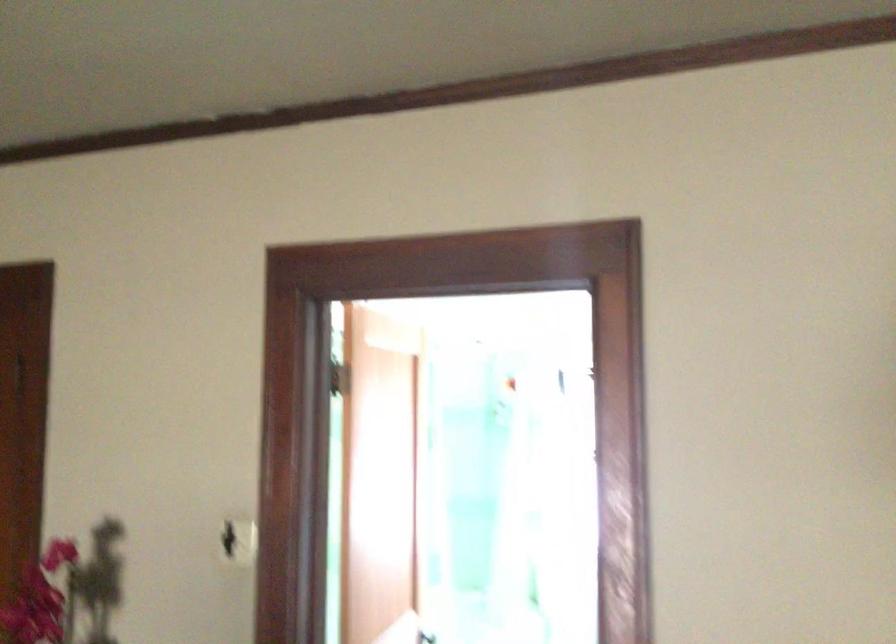
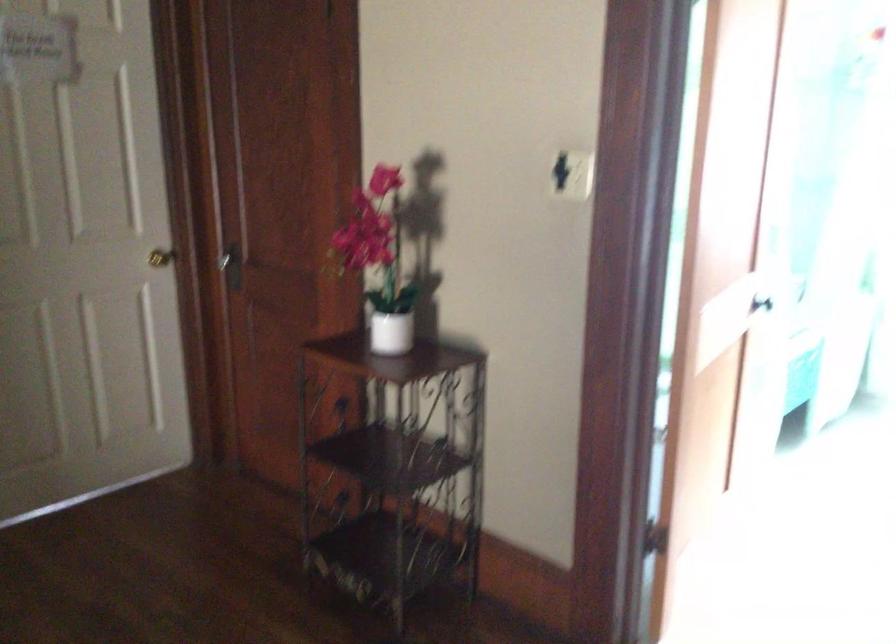
First-person continuous shooting, in which direction is the camera rotating?

The camera's rotation is toward left-down.